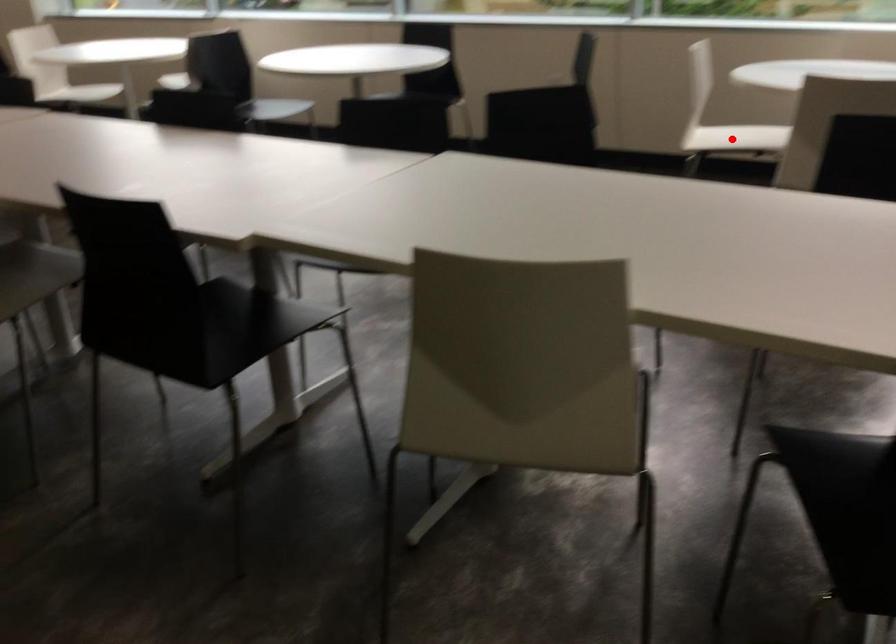
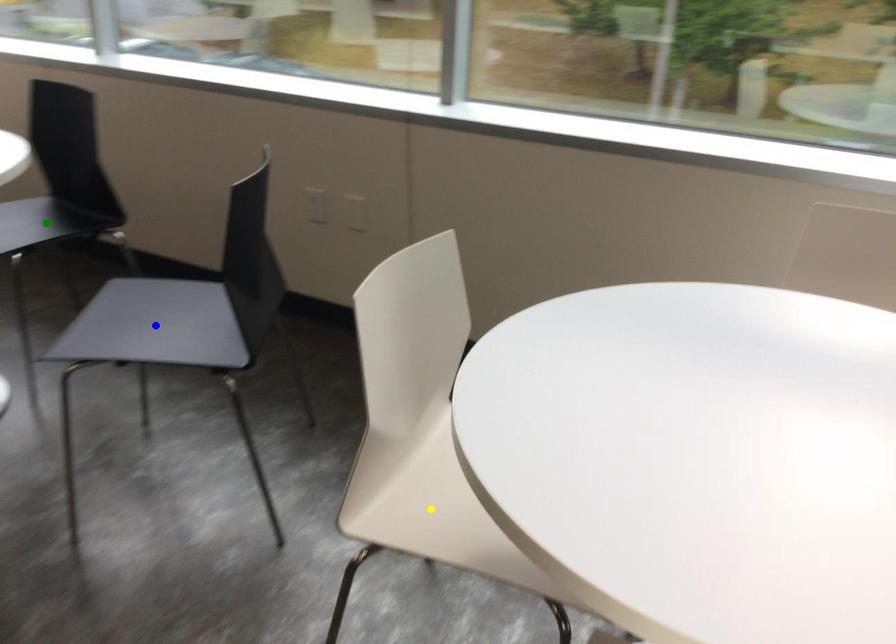
Question: I am providing you with two images of the same scene from different viewpoints. A red point is marked on the first image. You are given multiple points on the second image. Which point in image 2 represents the same 3d spot as the red point in image 1?

Choices:
 (A) green point
 (B) yellow point
 (C) blue point

Answer: (B)